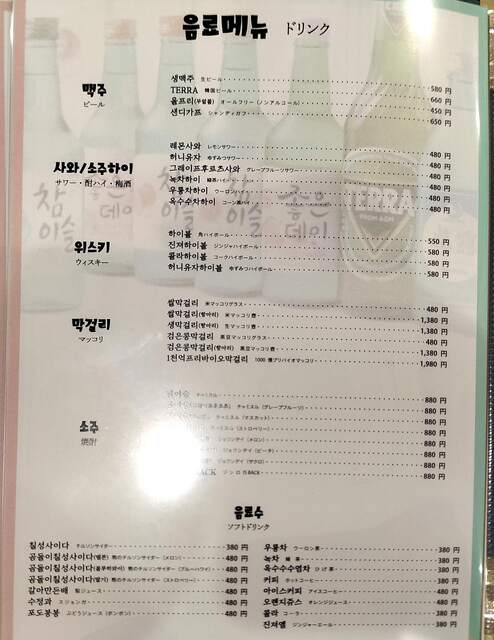
Where is `clock`? clock is located at coordinates (65, 36).